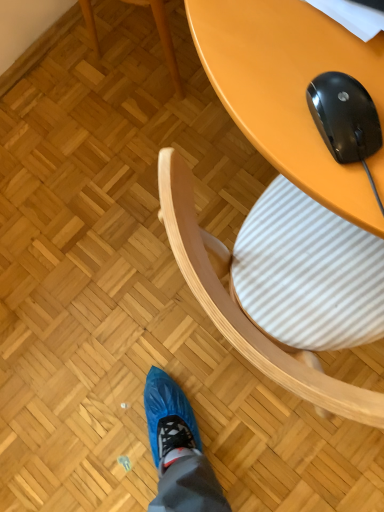
I want to click on free spot below wooden chair at upper center (from a real-world perspective), so click(x=145, y=45).